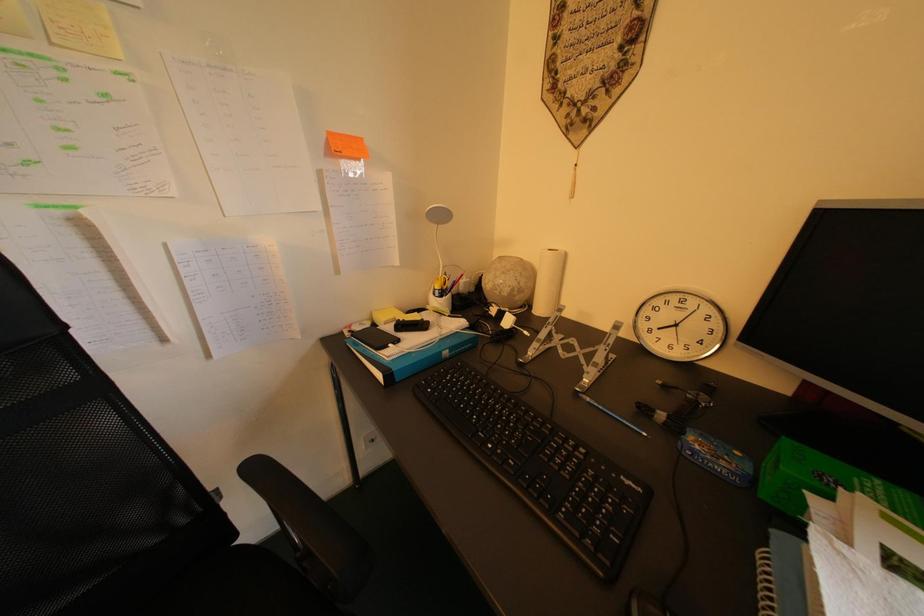
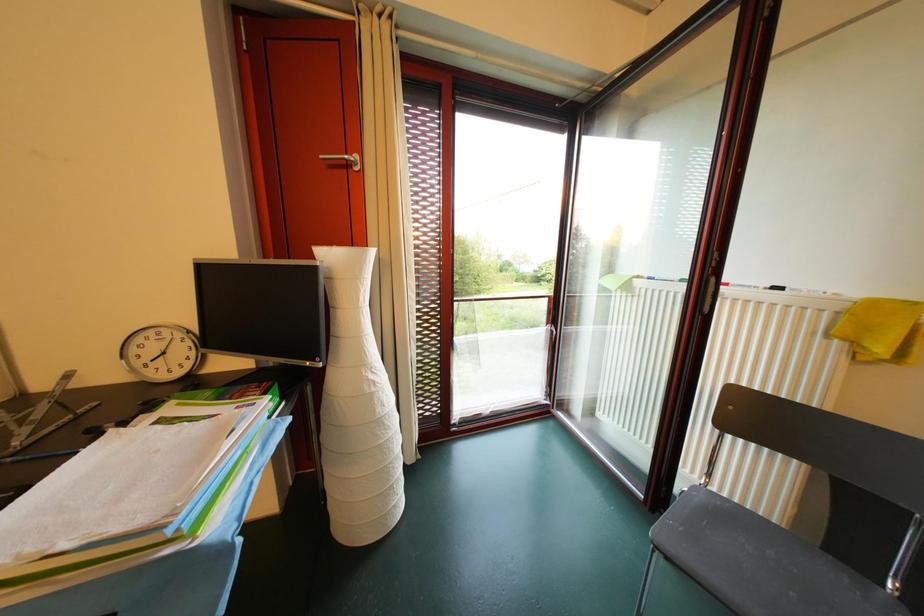
Question: Based on the continuous images, in which direction is the camera rotating? Reply with the corresponding letter.

Choices:
 (A) Left
 (B) Right
 (C) Up
 (D) Down

Answer: (B)